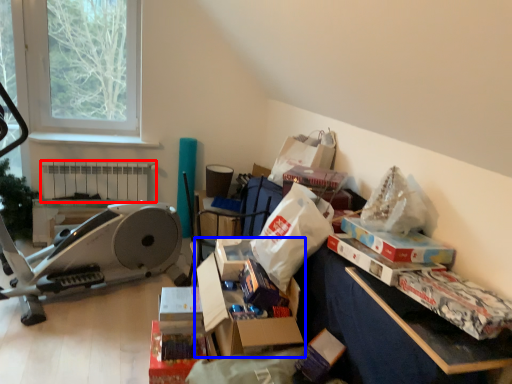
Question: Among these objects, which one is nearest to the camera, radiator (highlighted by a red box) or storage box (highlighted by a blue box)?

Choices:
 (A) radiator
 (B) storage box

Answer: (B)